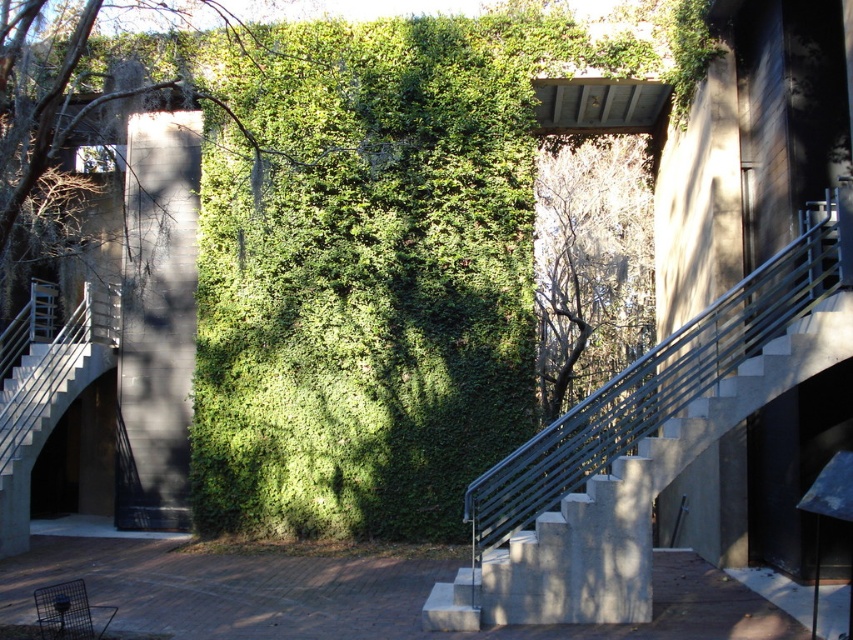
Consider the image. Between concrete stairs at center and green leafy wall at upper center, which one is positioned higher?

green leafy wall at upper center is higher up.

Is concrete stairs at center positioned at the back of green leafy wall at upper center?

Yes, it is.

Between point (664, 445) and point (86, 22), which one is positioned behind?

The point (664, 445) is more distant.

At what (x,y) coordinates should I click in order to perform the action: click on concrete stairs at center. Please return your answer as a coordinate pair (x, y). This screenshot has height=640, width=853. Looking at the image, I should click on (627, 502).

Can you confirm if green leafy wall at upper center is positioned below green leafy tree at center?

Actually, green leafy wall at upper center is above green leafy tree at center.

Which is more to the left, green leafy wall at upper center or green leafy tree at center?

green leafy wall at upper center

Who is more distant from viewer, (20,180) or (616,349)?

Point (616,349)

The image size is (853, 640). I want to click on green leafy wall at upper center, so click(71, 118).

Is concrete stairs at center below green leafy tree at center?

Correct, concrete stairs at center is located below green leafy tree at center.

Which is more to the right, concrete stairs at center or green leafy tree at center?

green leafy tree at center is more to the right.

The image size is (853, 640). What do you see at coordinates (627, 502) in the screenshot?
I see `concrete stairs at center` at bounding box center [627, 502].

The image size is (853, 640). Identify the location of concrete stairs at center. [x=627, y=502].